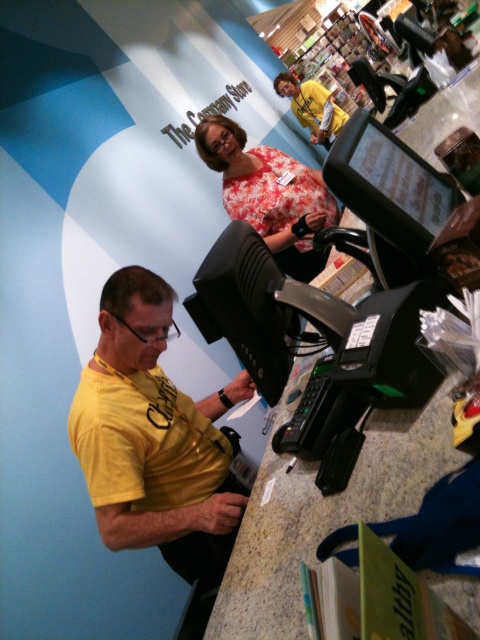
Can you confirm if floral fabric blouse at center is positioned above yellow matte shirt at upper center?

Incorrect, floral fabric blouse at center is not positioned above yellow matte shirt at upper center.

Can you confirm if floral fabric blouse at center is positioned to the right of yellow matte shirt at upper center?

Incorrect, floral fabric blouse at center is not on the right side of yellow matte shirt at upper center.

Who is more distant from viewer, (230, 212) or (325, 104)?

The point (325, 104) is more distant.

Where is `floral fabric blouse at center`? The height and width of the screenshot is (640, 480). floral fabric blouse at center is located at coordinates (269, 195).

Is yellow matte shirt at center taller than yellow matte shirt at upper center?

Correct, yellow matte shirt at center is much taller as yellow matte shirt at upper center.

Is yellow matte shirt at center bigger than yellow matte shirt at upper center?

No.

Between point (171, 436) and point (283, 74), which one is positioned in front?

Point (171, 436) is in front.

Locate an element on the screen. This screenshot has height=640, width=480. yellow matte shirt at center is located at coordinates (154, 436).

Is point (160, 394) farther from viewer compared to point (302, 196)?

No, it is not.

Can you confirm if yellow matte shirt at center is positioned above floral fabric blouse at center?

No.

Who is more forward, (x=121, y=344) or (x=272, y=209)?

Positioned in front is point (x=121, y=344).

Locate an element on the screen. The width and height of the screenshot is (480, 640). yellow matte shirt at center is located at coordinates (154, 436).